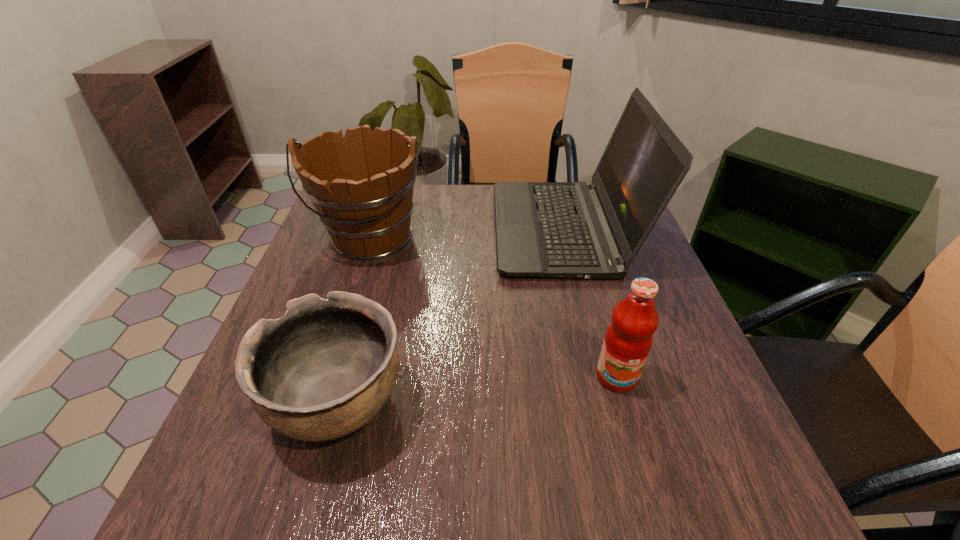
What are the coordinates of `free location that satisfies the following two spatial constraints: 1. with the handle on the shortest object; 2. on the left side of the wine bucket` in the screenshot? It's located at (319, 402).